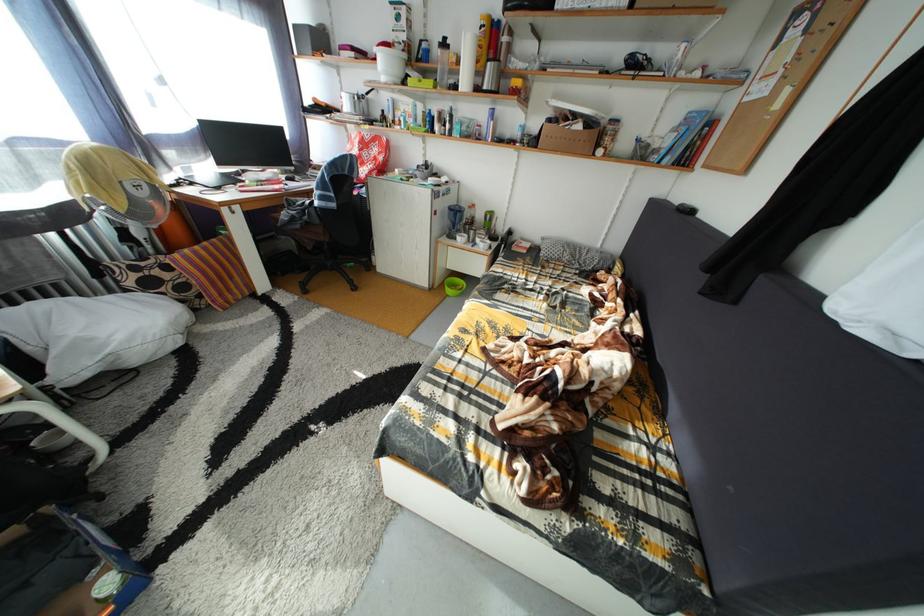
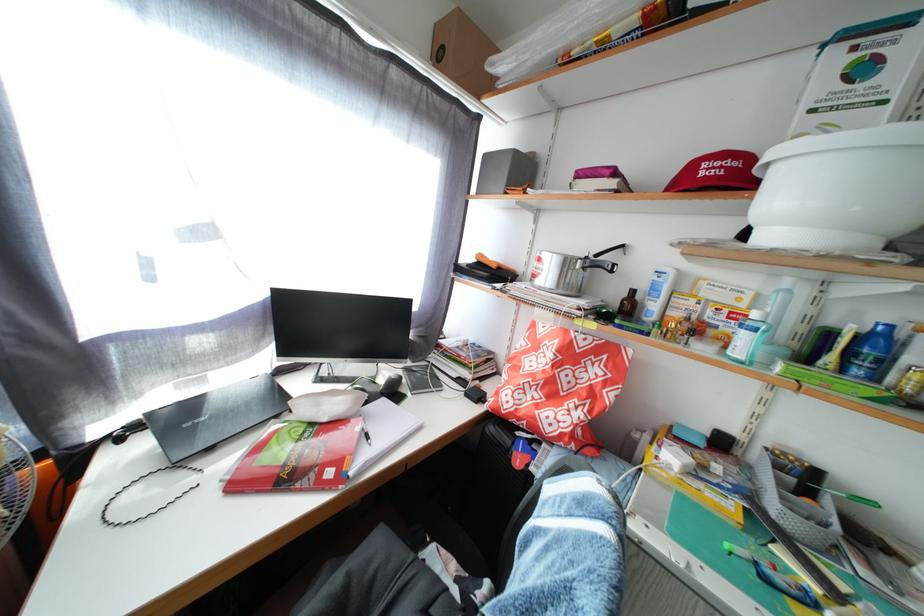
Locate, in the second image, the point that corresponds to point (322, 105) in the first image.

(489, 262)